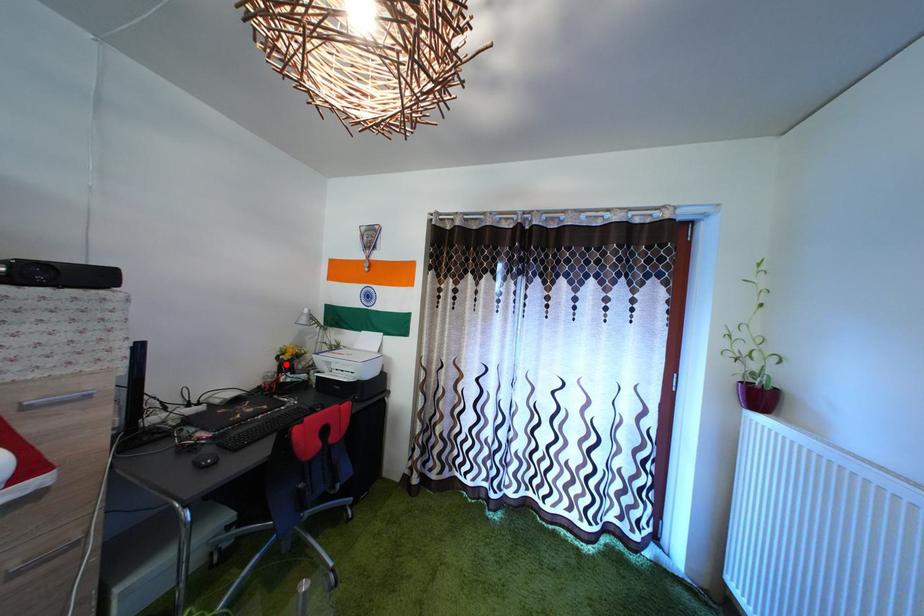
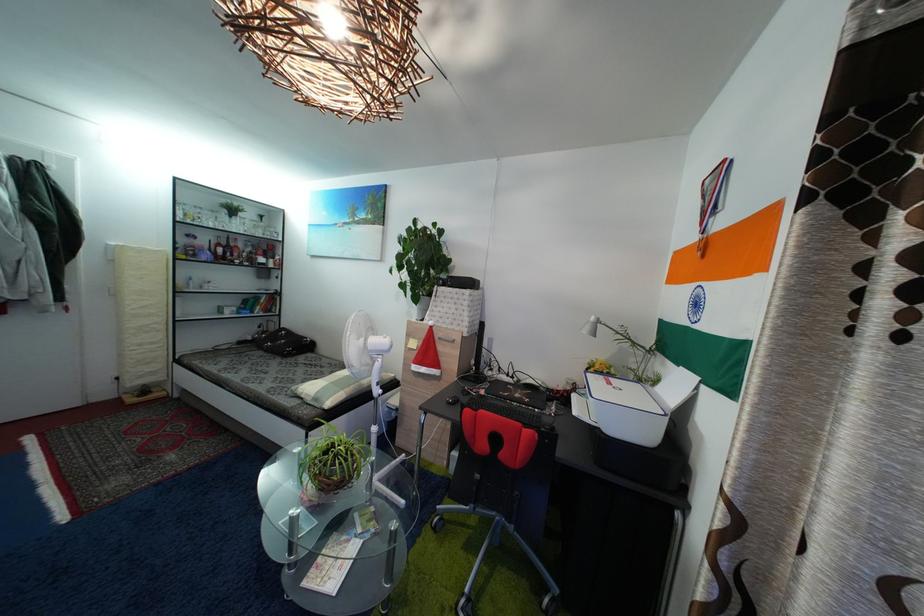
Question: A red point is marked in image1. In image2, is the corresponding 3D point closer to the camera or farther? Reply with the corresponding letter.

Choices:
 (A) The corresponding 3D point is closer.
 (B) The corresponding 3D point is farther.

Answer: (A)